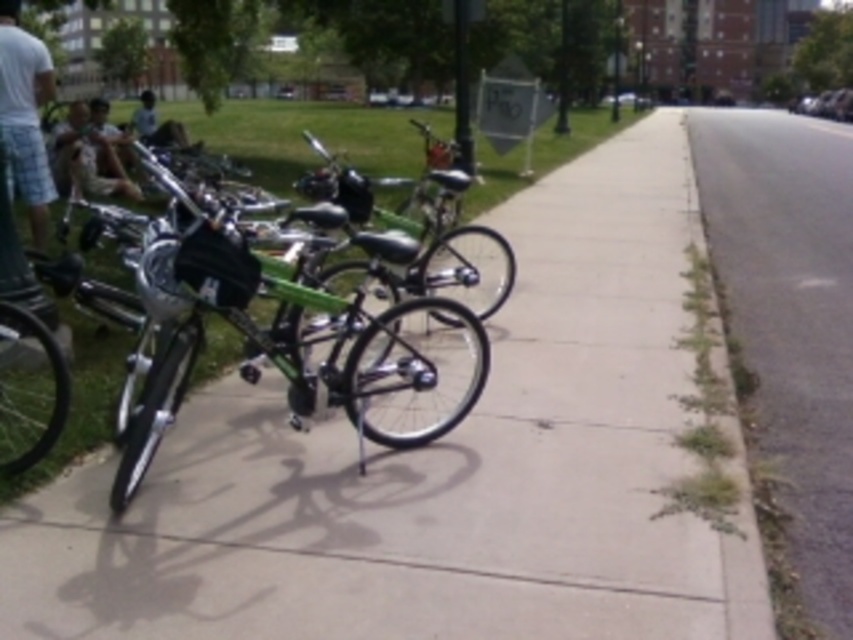
Describe the element at coordinates (325, 355) in the screenshot. I see `green matte bicycle at center` at that location.

Which of these two, green matte bicycle at center or camouflage fabric backpack at left, stands shorter?

With less height is camouflage fabric backpack at left.

Consider the image. Measure the distance between point (293, 282) and camera.

Point (293, 282) and camera are 16.39 feet apart from each other.

You are a GUI agent. You are given a task and a screenshot of the screen. Output one action in this format:
    pyautogui.click(x=<x>, y=<y>)
    Task: Click on the green matte bicycle at center
    The image size is (853, 640).
    Given the screenshot: What is the action you would take?
    pyautogui.click(x=325, y=355)

From the picture: Does green matte bicycle at center lie in front of green grass at lower right?

No, green matte bicycle at center is further to the viewer.

What do you see at coordinates (325, 355) in the screenshot? This screenshot has height=640, width=853. I see `green matte bicycle at center` at bounding box center [325, 355].

At what (x,y) coordinates should I click in order to perform the action: click on green matte bicycle at center. Please return your answer as a coordinate pair (x, y). The height and width of the screenshot is (640, 853). Looking at the image, I should click on (325, 355).

Is smooth concrete sidewalk at center thinner than dark blue jeans at center?

Indeed, smooth concrete sidewalk at center has a lesser width compared to dark blue jeans at center.

Does smooth concrete sidewalk at center have a lesser height compared to dark blue jeans at center?

Yes.

Between point (77, 627) and point (144, 90), which one is positioned behind?

The point (144, 90) is behind.

The width and height of the screenshot is (853, 640). I want to click on smooth concrete sidewalk at center, so click(427, 467).